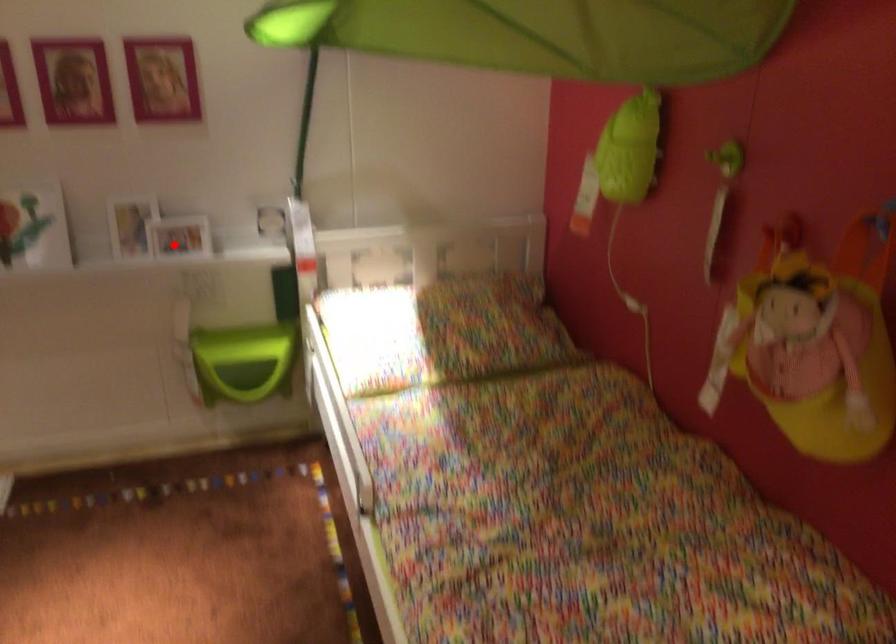
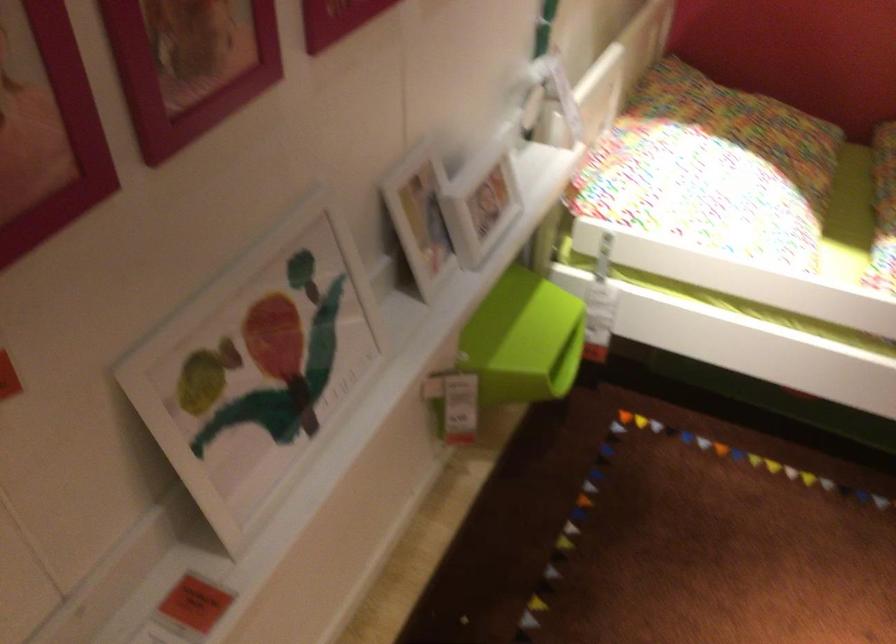
Locate, in the second image, the point that corresponds to the highlighted location in the first image.

(479, 200)